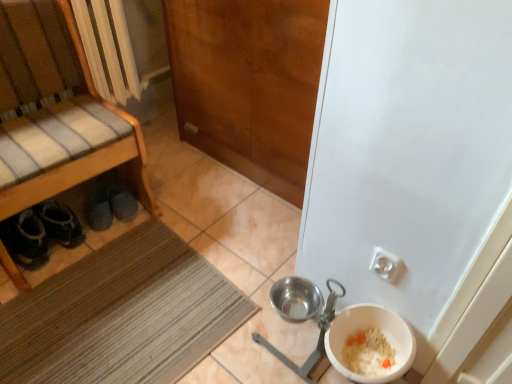
This screenshot has height=384, width=512. Identify the location of empty space that is in between wooden bench at left and wooden door at center. coord(190,208).